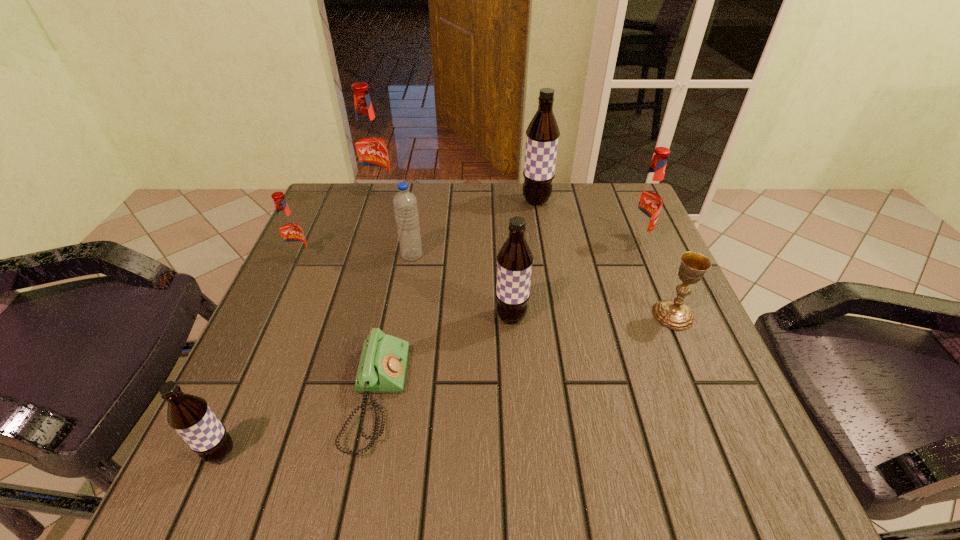
Find the location of a particular element. the smallest red root beer is located at coordinates (290, 232).

The height and width of the screenshot is (540, 960). I want to click on the leftmost brown root beer, so click(190, 416).

Locate an element on the screen. This screenshot has height=540, width=960. the smallest brown root beer is located at coordinates (190, 416).

Image resolution: width=960 pixels, height=540 pixels. I want to click on the second shortest object, so click(673, 313).

The height and width of the screenshot is (540, 960). In order to click on gold chalice in this screenshot , I will do `click(673, 313)`.

Find the location of a particular element. the shortest object is located at coordinates (382, 367).

Image resolution: width=960 pixels, height=540 pixels. I want to click on vacant space located 0.230m on the front of the fifth root beer from left to right, so click(547, 267).

This screenshot has width=960, height=540. Find the location of `free space located 0.330m on the front of the farthest red root beer`. free space located 0.330m on the front of the farthest red root beer is located at coordinates (350, 284).

I want to click on free space located 0.120m on the left of the second smallest red root beer, so click(x=574, y=239).

Locate an element on the screen. The height and width of the screenshot is (540, 960). vacant space located 0.050m on the left of the second nearest brown root beer is located at coordinates (470, 316).